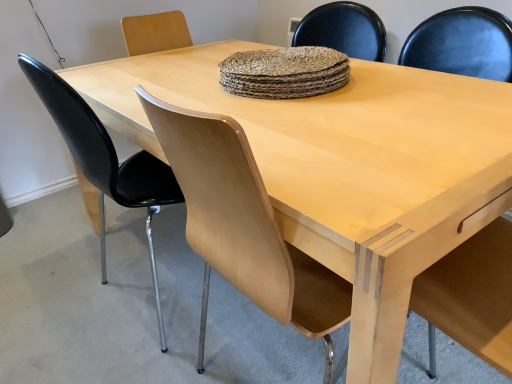
Question: Visually, is light wood chair at center, the 1th chair when ordered from right to left, positioned to the left or to the right of black glossy chair at left, the 1th chair when ordered from left to right?

Choices:
 (A) right
 (B) left

Answer: (A)

Question: From the image's perspective, is light wood chair at center, the 1th chair when ordered from right to left, positioned above or below black glossy chair at left, the 2th chair when ordered from right to left?

Choices:
 (A) below
 (B) above

Answer: (A)

Question: Considering the real-world distances, which object is closest to the light wood chair at center, the second chair in the left-to-right sequence?

Choices:
 (A) light wood armchair at right
 (B) black glossy chair at left, the 2th chair when ordered from right to left

Answer: (B)

Question: Based on their relative distances, which object is farther from the black glossy chair at left, the 1th chair when ordered from left to right?

Choices:
 (A) light wood chair at center, the second chair in the left-to-right sequence
 (B) light wood armchair at right

Answer: (B)